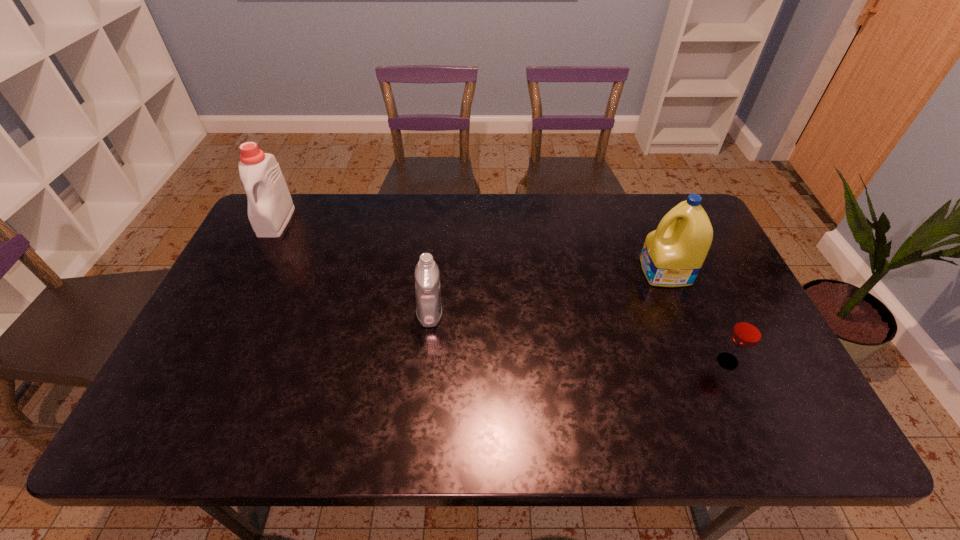
This screenshot has width=960, height=540. Find the location of `vacant region between the third nearest object and the nearest object`. vacant region between the third nearest object and the nearest object is located at coordinates (696, 316).

The height and width of the screenshot is (540, 960). Find the location of `vacant area that lies between the third object from right to left and the second nearest detergent`. vacant area that lies between the third object from right to left and the second nearest detergent is located at coordinates (547, 293).

Find the location of `free area in between the shortest object and the shortest detergent`. free area in between the shortest object and the shortest detergent is located at coordinates (579, 338).

The image size is (960, 540). I want to click on vacant space in between the glass and the third object from right to left, so click(x=579, y=338).

Where is `object that is the third closest to the nearest object`? The image size is (960, 540). object that is the third closest to the nearest object is located at coordinates (270, 207).

Choose which object is the third nearest neighbor to the shortest object. Please provide its 2D coordinates. Your answer should be formatted as a tuple, i.e. [(x, y)], where the tuple contains the x and y coordinates of a point satisfying the conditions above.

[(270, 207)]

Locate an element on the screen. The image size is (960, 540). detergent that can be found as the third closest to the shortest object is located at coordinates (270, 207).

This screenshot has height=540, width=960. I want to click on the closest detergent to the glass, so click(x=672, y=256).

At what (x,y) coordinates should I click in order to perform the action: click on vacant region that satisfies the following two spatial constraints: 1. on the handle side of the farthest object; 2. on the left side of the shortest detergent. Please return your answer as a coordinate pair (x, y). Looking at the image, I should click on (228, 314).

The image size is (960, 540). What are the coordinates of `vacant area in the image that satisfies the following two spatial constraints: 1. on the handle side of the leftmost detergent; 2. on the left side of the second detergent from right to left` in the screenshot? It's located at (228, 314).